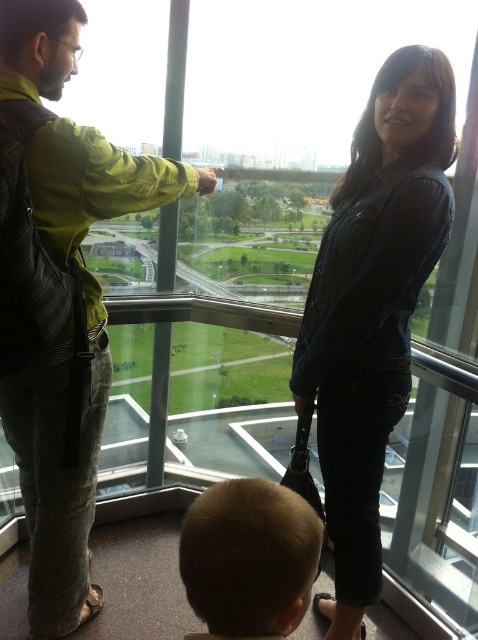
You are standing in the modern building looking through the large glass windows. You notice two points marked in the scene. The first point is at coordinates point (0,24) and the second is at point (391,109). Which point is closer to you?

Point (0,24) is in front of point (391,109), so it is closer to you.

You are a photographer standing in front of the camera. You want to take a photo of the green fabric jacket at upper left without moving it. Can you fit the entire jacket into your camera frame, which has a maximum width of 1 meter?

The green fabric jacket at upper left is 1.20 meters from the camera. Since the jacket is 1.20 meters away and the camera frame can only accommodate up to 1 meter in width, the jacket will not fit entirely within the frame. You would need to adjust your position or use a different lens to capture it fully.

Consider the image. You are a photographer trying to capture a group photo of the denim jacket at center and the blonde hair at lower center. If you want to ensure both subjects are fully visible in the frame, which subject requires more horizontal space in the composition?

The denim jacket at center requires more horizontal space in the composition because its width surpasses that of the blonde hair at lower center.